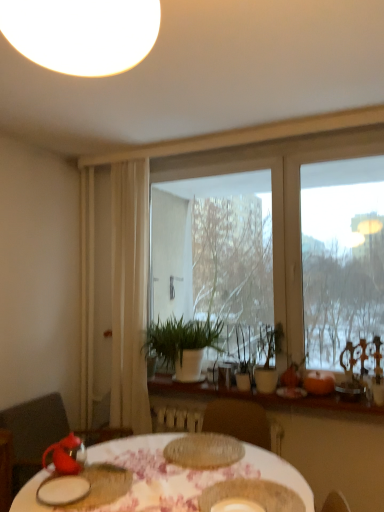
Question: Does transparent glass window at center have a larger size compared to orange matte pumpkin at right, arranged as the 2th tableware when viewed from the right?

Choices:
 (A) yes
 (B) no

Answer: (A)

Question: Considering the relative sizes of transparent glass window at center and orange matte pumpkin at right, the 9th tableware from the left, in the image provided, is transparent glass window at center thinner than orange matte pumpkin at right, the 9th tableware from the left,?

Choices:
 (A) no
 (B) yes

Answer: (B)

Question: Can you confirm if transparent glass window at center is wider than orange matte pumpkin at right, arranged as the 2th tableware when viewed from the right?

Choices:
 (A) yes
 (B) no

Answer: (B)

Question: From the image's perspective, is transparent glass window at center on orange matte pumpkin at right, the 9th tableware from the left?

Choices:
 (A) yes
 (B) no

Answer: (A)

Question: Is transparent glass window at center taller than orange matte pumpkin at right, arranged as the 2th tableware when viewed from the right?

Choices:
 (A) yes
 (B) no

Answer: (A)

Question: Would you say transparent glass window at center contains orange matte pumpkin at right, arranged as the 2th tableware when viewed from the right?

Choices:
 (A) yes
 (B) no

Answer: (B)

Question: Can you confirm if metallic silver tray at right, marked as the first tableware in a right-to-left arrangement, is thinner than matte red teapot at lower left, the third tableware from the left?

Choices:
 (A) yes
 (B) no

Answer: (A)

Question: Considering the relative sizes of metallic silver tray at right, marked as the first tableware in a right-to-left arrangement, and matte red teapot at lower left, the third tableware from the left, in the image provided, is metallic silver tray at right, marked as the first tableware in a right-to-left arrangement, taller than matte red teapot at lower left, the third tableware from the left,?

Choices:
 (A) no
 (B) yes

Answer: (B)

Question: Is the depth of metallic silver tray at right, marked as the first tableware in a right-to-left arrangement, less than that of matte red teapot at lower left, the eighth tableware viewed from the right?

Choices:
 (A) no
 (B) yes

Answer: (A)

Question: From a real-world perspective, is metallic silver tray at right, which is counted as the 10th tableware, starting from the left, located beneath matte red teapot at lower left, the eighth tableware viewed from the right?

Choices:
 (A) yes
 (B) no

Answer: (B)

Question: Is metallic silver tray at right, marked as the first tableware in a right-to-left arrangement, bigger than matte red teapot at lower left, the third tableware from the left?

Choices:
 (A) yes
 (B) no

Answer: (A)

Question: From the image's perspective, is metallic silver tray at right, marked as the first tableware in a right-to-left arrangement, on matte red teapot at lower left, the third tableware from the left?

Choices:
 (A) no
 (B) yes

Answer: (B)

Question: Does white sheer curtain at left have a smaller size compared to orange matte pumpkin at right, the 9th tableware from the left?

Choices:
 (A) yes
 (B) no

Answer: (B)